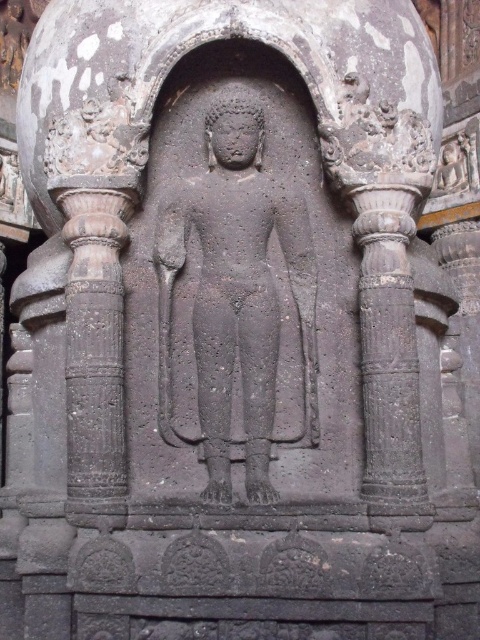
You are an art conservator examining the stone carving. You need to document the position of the black stone statue at center relative to the dark gray stone column at left. Which side of the column is the statue located on?

The black stone statue at center is to the right of the dark gray stone column at left, so it is located on the right side of the column.

Based on the photo, you are an art conservator examining the stone carving. You notice two points on the carving labeled as point (200, 390) and point (372, 397). Which point is closer to your current position as you look at the carving?

Point (200, 390) is further to the viewer than point (372, 397), so the point closer to your position is point (200, 390).

Consider the image. You are an architect analyzing the symmetry of the stone carving. Since both dark gray stone column at left and dark gray stone column at right are part of the arched niche, which one takes up more space in the carving?

The dark gray stone column at right takes up more space in the carving than the dark gray stone column at left, as it occupies more space according to the description.